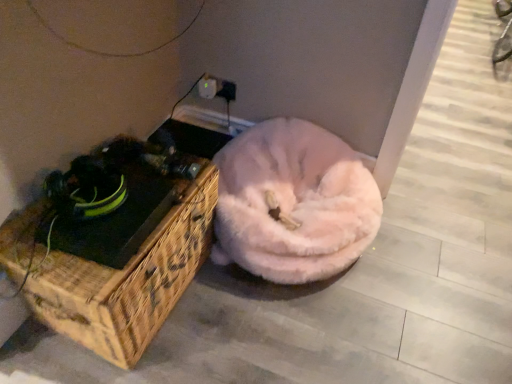
Question: Should I look upward or downward to see white plastic electric outlet at upper center?

Choices:
 (A) down
 (B) up

Answer: (B)

Question: From a real-world perspective, is white plastic electric outlet at upper center below woven wood chest at left?

Choices:
 (A) yes
 (B) no

Answer: (B)

Question: Is white plastic electric outlet at upper center wider than woven wood chest at left?

Choices:
 (A) yes
 (B) no

Answer: (B)

Question: Can you confirm if white plastic electric outlet at upper center is thinner than woven wood chest at left?

Choices:
 (A) yes
 (B) no

Answer: (A)

Question: Is white plastic electric outlet at upper center oriented towards woven wood chest at left?

Choices:
 (A) no
 (B) yes

Answer: (B)

Question: Is woven wood chest at left at the back of white plastic electric outlet at upper center?

Choices:
 (A) no
 (B) yes

Answer: (A)

Question: Considering the relative positions of white plastic electric outlet at upper center and woven wood chest at left in the image provided, is white plastic electric outlet at upper center to the left of woven wood chest at left from the viewer's perspective?

Choices:
 (A) no
 (B) yes

Answer: (A)

Question: Considering the relative sizes of fuzzy pink dog bed at center and white plastic electric outlet at upper center in the image provided, is fuzzy pink dog bed at center smaller than white plastic electric outlet at upper center?

Choices:
 (A) yes
 (B) no

Answer: (B)

Question: Is fuzzy pink dog bed at center closer to the viewer compared to white plastic electric outlet at upper center?

Choices:
 (A) no
 (B) yes

Answer: (B)

Question: From the image's perspective, is fuzzy pink dog bed at center beneath white plastic electric outlet at upper center?

Choices:
 (A) yes
 (B) no

Answer: (A)

Question: Is white plastic electric outlet at upper center completely or partially inside fuzzy pink dog bed at center?

Choices:
 (A) no
 (B) yes

Answer: (A)

Question: Does fuzzy pink dog bed at center have a lesser width compared to white plastic electric outlet at upper center?

Choices:
 (A) no
 (B) yes

Answer: (A)

Question: Is fuzzy pink dog bed at center to the right of white plastic electric outlet at upper center from the viewer's perspective?

Choices:
 (A) no
 (B) yes

Answer: (B)

Question: Are woven wood chest at left and white plastic electric outlet at upper center located far from each other?

Choices:
 (A) no
 (B) yes

Answer: (A)